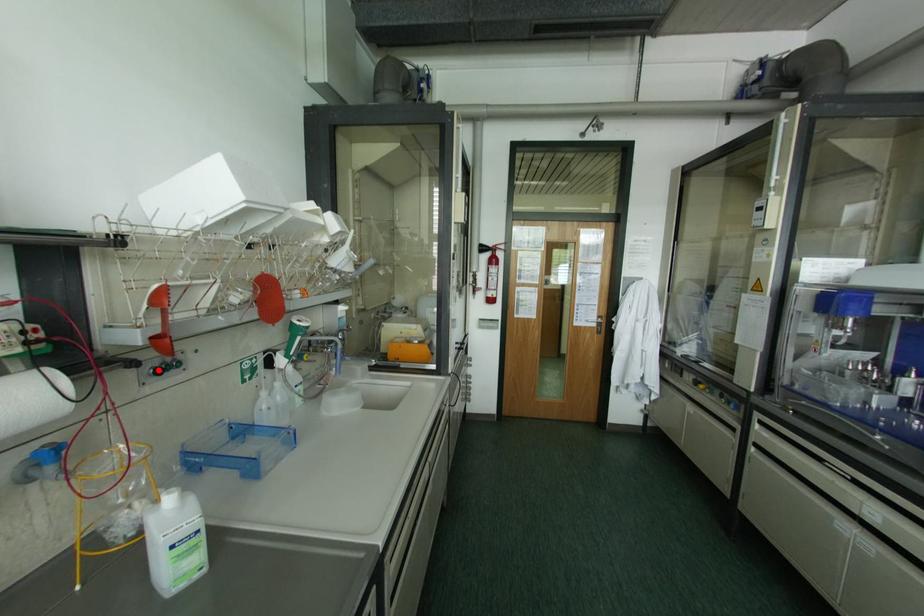
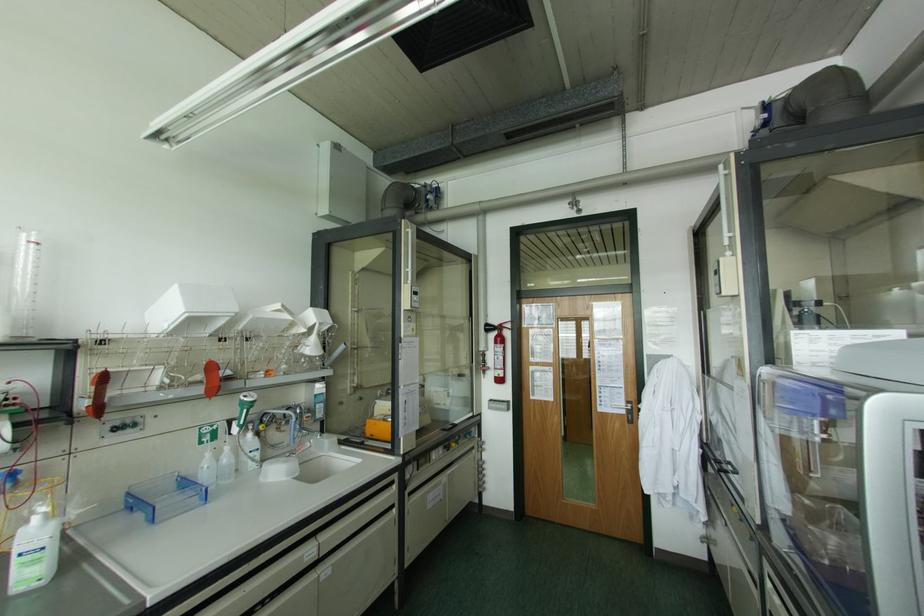
Find the pixel in the second image that matches the highlighted location in the first image.

(115, 428)